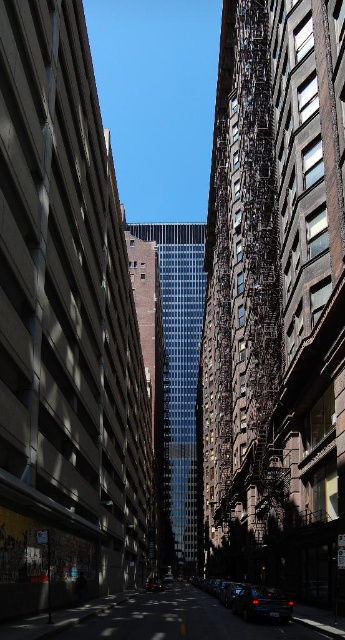
Between point (278, 602) and point (159, 586), which one is positioned behind?

Positioned behind is point (159, 586).

Does point (252, 604) lie in front of point (162, 584)?

Yes, point (252, 604) is in front of point (162, 584).

This screenshot has width=345, height=640. Find the location of `glossy black car at center`. glossy black car at center is located at coordinates (261, 604).

Identify the location of glossy black car at center. The height and width of the screenshot is (640, 345). (261, 604).

Which is in front, point (262, 605) or point (159, 589)?

Positioned in front is point (262, 605).

The height and width of the screenshot is (640, 345). I want to click on shiny black car at lower center, so click(x=249, y=600).

Who is lower down, shiny black car at lower center or glossy black car at center?

shiny black car at lower center is below.

Is shiny black car at lower center taller than glossy black car at center?

Yes.

Which is behind, point (271, 593) or point (283, 598)?

Positioned behind is point (271, 593).

I want to click on shiny black car at lower center, so pos(249,600).